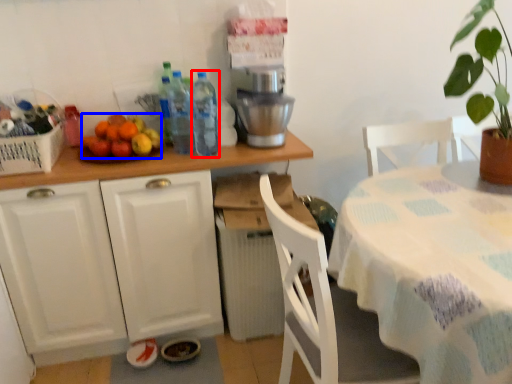
Question: Among these objects, which one is nearest to the camera, bottle (highlighted by a red box) or fruit (highlighted by a blue box)?

Choices:
 (A) bottle
 (B) fruit

Answer: (A)